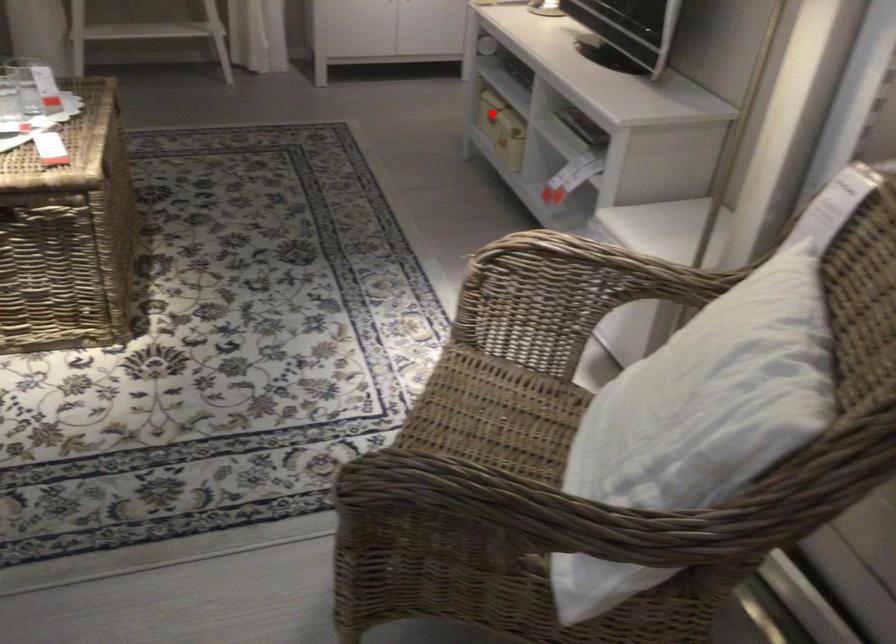
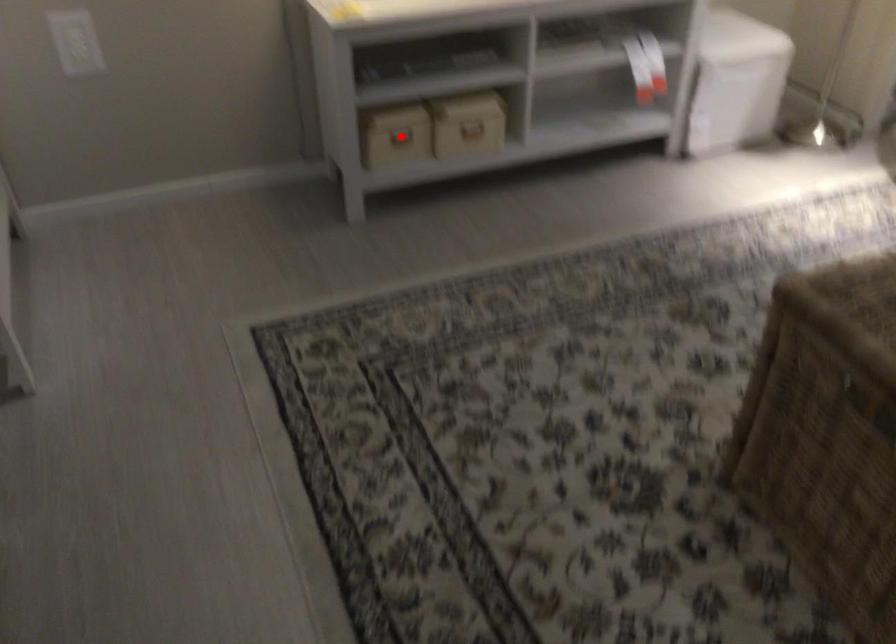
I am providing you with two images of the same scene from different viewpoints. A red point is marked on the first image and another point is marked on the second image. Is the red point in image1 aligned with the point shown in image2?

Yes